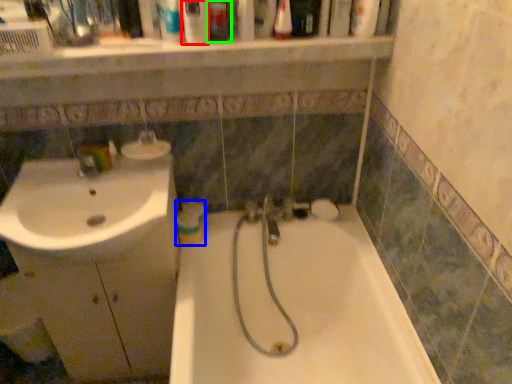
Question: Based on their relative distances, which object is farther from mouthwash (highlighted by a red box)? Choose from mouthwash (highlighted by a blue box) and toiletry (highlighted by a green box).

Choices:
 (A) mouthwash
 (B) toiletry

Answer: (A)